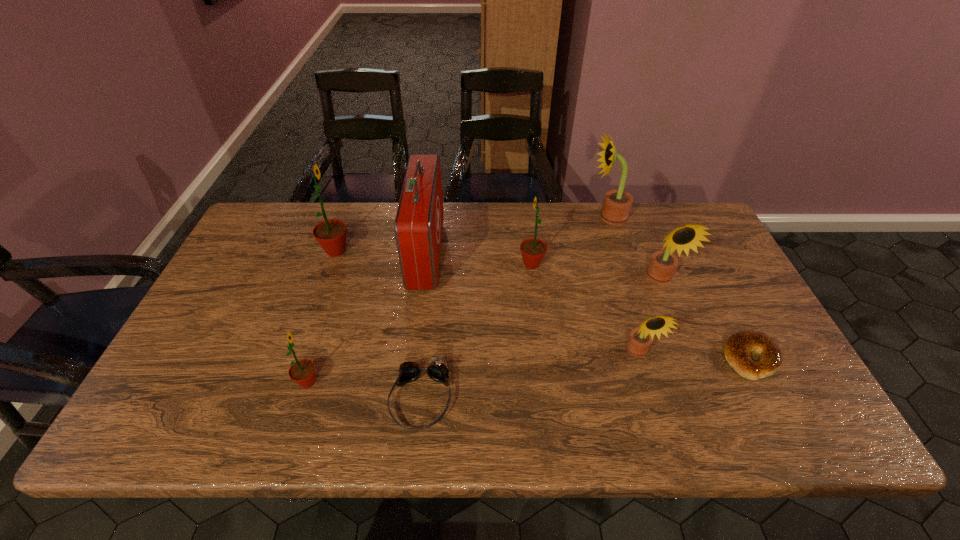
The width and height of the screenshot is (960, 540). Identify the location of free space that is in between the farthest sunflower and the second smallest yellow sunflower. (635, 248).

Locate an element on the screen. vacant area that lies between the nearest green sunflower and the bagel is located at coordinates (529, 370).

Locate an element on the screen. The image size is (960, 540). free space between the first-aid kit and the bronze goggles is located at coordinates (423, 326).

You are a GUI agent. You are given a task and a screenshot of the screen. Output one action in this format:
    pyautogui.click(x=<x>, y=<y>)
    Task: Click on the free space between the nearest sunflower and the eighth tallest object
    
    Given the screenshot: What is the action you would take?
    pyautogui.click(x=364, y=390)

You are a GUI agent. You are given a task and a screenshot of the screen. Output one action in this format:
    pyautogui.click(x=<x>, y=<y>)
    Task: Click on the vacant point located between the smallest yellow sunflower and the nearest sunflower
    
    Given the screenshot: What is the action you would take?
    pyautogui.click(x=473, y=367)

The width and height of the screenshot is (960, 540). I want to click on the eighth closest object relative to the nearest green sunflower, so click(x=737, y=349).

You are a GUI agent. You are given a task and a screenshot of the screen. Output one action in this format:
    pyautogui.click(x=<x>, y=<y>)
    Task: Click on the object that is the second nearest to the first-aid kit
    This screenshot has width=960, height=540.
    Given the screenshot: What is the action you would take?
    pyautogui.click(x=438, y=370)

Locate which sunflower is the second closest to the nearest green sunflower. Please provide its 2D coordinates. Your answer should be formatted as a tuple, i.e. [(x, y)], where the tuple contains the x and y coordinates of a point satisfying the conditions above.

[(533, 250)]

Where is `sunflower identified as the closest to the shortest object`? The height and width of the screenshot is (540, 960). sunflower identified as the closest to the shortest object is located at coordinates (662, 265).

Point out which yellow sunflower is positioned as the second nearest to the goggles. Please provide its 2D coordinates. Your answer should be formatted as a tuple, i.e. [(x, y)], where the tuple contains the x and y coordinates of a point satisfying the conditions above.

[(662, 265)]